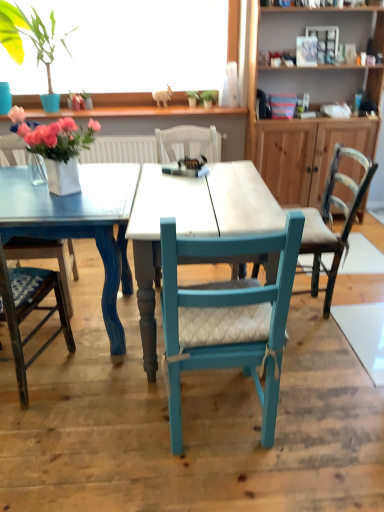
This screenshot has width=384, height=512. What do you see at coordinates (332, 220) in the screenshot?
I see `teal fabric chair at center, placed as the 4th chair when sorted from left to right` at bounding box center [332, 220].

This screenshot has width=384, height=512. What do you see at coordinates (227, 318) in the screenshot?
I see `teal painted wood chair at center, which is the third chair from left to right` at bounding box center [227, 318].

Find the location of `matte blue chair at left, placed as the fourth chair when sorted from right to left`. matte blue chair at left, placed as the fourth chair when sorted from right to left is located at coordinates (46, 257).

Locate an element on the screen. wooden cabinet at upper right is located at coordinates (311, 100).

Identify the location of blue fabric cushioned chair at left, arranged as the 2th chair when viewed from the left. (31, 300).

The width and height of the screenshot is (384, 512). Find the location of `matte pink flowers at left`. matte pink flowers at left is located at coordinates (57, 148).

This screenshot has width=384, height=512. What do you see at coordinates (193, 222) in the screenshot?
I see `white wood table at center` at bounding box center [193, 222].

Find the location of `teal fabric chair at center, the 1th chair positioned from the right`. teal fabric chair at center, the 1th chair positioned from the right is located at coordinates (332, 220).

How distant is teal fabric chair at center, the 1th chair positioned from the right, from white wood table at center?

25.15 inches.

Is teal fabric chair at center, placed as the 4th chair when sorted from left to right, further to the viewer compared to white wood table at center?

Yes, the depth of teal fabric chair at center, placed as the 4th chair when sorted from left to right, is greater than that of white wood table at center.

Between teal fabric chair at center, placed as the 4th chair when sorted from left to right, and white wood table at center, which one has smaller width?

teal fabric chair at center, placed as the 4th chair when sorted from left to right.

In the scene shown: Is teal fabric chair at center, placed as the 4th chair when sorted from left to right, outside of white wood table at center?

Absolutely, teal fabric chair at center, placed as the 4th chair when sorted from left to right, is external to white wood table at center.

Between teal fabric chair at center, the 1th chair positioned from the right, and green leafy plant at upper left, which one appears on the left side from the viewer's perspective?

green leafy plant at upper left is more to the left.

Which of these two, teal fabric chair at center, placed as the 4th chair when sorted from left to right, or green leafy plant at upper left, is smaller?

Smaller between the two is teal fabric chair at center, placed as the 4th chair when sorted from left to right.

Is teal fabric chair at center, the 1th chair positioned from the right, far away from green leafy plant at upper left?

Absolutely, teal fabric chair at center, the 1th chair positioned from the right, is distant from green leafy plant at upper left.

The height and width of the screenshot is (512, 384). What are the coordinates of `houseplant above the teal fabric chair at center, the 1th chair positioned from the right (from the image's perspective)` in the screenshot? It's located at (27, 36).

Find the location of `houseplant that is behind the matte blue chair at left, the 1th chair when ordered from left to right`. houseplant that is behind the matte blue chair at left, the 1th chair when ordered from left to right is located at coordinates (27, 36).

Is matte blue chair at left, placed as the fourth chair when sorted from right to left, at the right side of green leafy plant at upper left?

Indeed, matte blue chair at left, placed as the fourth chair when sorted from right to left, is positioned on the right side of green leafy plant at upper left.

Looking at this image, is matte blue chair at left, placed as the fourth chair when sorted from right to left, positioned beyond the bounds of green leafy plant at upper left?

Yes, matte blue chair at left, placed as the fourth chair when sorted from right to left, is located beyond the bounds of green leafy plant at upper left.

In terms of size, does matte blue chair at left, placed as the fourth chair when sorted from right to left, appear bigger or smaller than teal painted wood chair at center, acting as the 2th chair starting from the right?

Considering their sizes, matte blue chair at left, placed as the fourth chair when sorted from right to left, takes up more space than teal painted wood chair at center, acting as the 2th chair starting from the right.

From the image's perspective, which one is positioned lower, matte blue chair at left, placed as the fourth chair when sorted from right to left, or teal painted wood chair at center, which is the third chair from left to right?

teal painted wood chair at center, which is the third chair from left to right, is shown below in the image.

Considering the positions of objects matte blue chair at left, the 1th chair when ordered from left to right, and teal painted wood chair at center, acting as the 2th chair starting from the right, in the image provided, who is more to the right, matte blue chair at left, the 1th chair when ordered from left to right, or teal painted wood chair at center, acting as the 2th chair starting from the right,?

teal painted wood chair at center, acting as the 2th chair starting from the right, is more to the right.

How far apart are matte blue chair at left, placed as the fourth chair when sorted from right to left, and teal painted wood chair at center, acting as the 2th chair starting from the right?

A distance of 34.30 inches exists between matte blue chair at left, placed as the fourth chair when sorted from right to left, and teal painted wood chair at center, acting as the 2th chair starting from the right.

Is blue fabric cushioned chair at left, marked as the third chair in a right-to-left arrangement, facing towards green leafy plant at upper left?

Yes, blue fabric cushioned chair at left, marked as the third chair in a right-to-left arrangement, is turned towards green leafy plant at upper left.

How far apart are blue fabric cushioned chair at left, arranged as the 2th chair when viewed from the left, and green leafy plant at upper left?

A distance of 5.85 feet exists between blue fabric cushioned chair at left, arranged as the 2th chair when viewed from the left, and green leafy plant at upper left.

Consider the image. What's the angular difference between blue fabric cushioned chair at left, marked as the third chair in a right-to-left arrangement, and green leafy plant at upper left's facing directions?

The facing directions of blue fabric cushioned chair at left, marked as the third chair in a right-to-left arrangement, and green leafy plant at upper left are 170 degrees apart.

Where is `houseplant on the left side of blue fabric cushioned chair at left, marked as the third chair in a right-to-left arrangement`? houseplant on the left side of blue fabric cushioned chair at left, marked as the third chair in a right-to-left arrangement is located at coordinates (27, 36).

Considering the sizes of objects white wood table at center and blue fabric cushioned chair at left, marked as the third chair in a right-to-left arrangement, in the image provided, who is taller, white wood table at center or blue fabric cushioned chair at left, marked as the third chair in a right-to-left arrangement,?

With more height is blue fabric cushioned chair at left, marked as the third chair in a right-to-left arrangement.

In the scene shown: Is white wood table at center looking in the opposite direction of blue fabric cushioned chair at left, arranged as the 2th chair when viewed from the left?

No, white wood table at center's orientation is not away from blue fabric cushioned chair at left, arranged as the 2th chair when viewed from the left.

How different are the orientations of white wood table at center and blue fabric cushioned chair at left, marked as the third chair in a right-to-left arrangement, in degrees?

171 degrees.

Which of these two, white wood table at center or blue fabric cushioned chair at left, arranged as the 2th chair when viewed from the left, is bigger?

Bigger between the two is white wood table at center.

Could you tell me if teal fabric chair at center, the 1th chair positioned from the right, is turned towards blue fabric cushioned chair at left, arranged as the 2th chair when viewed from the left?

No, teal fabric chair at center, the 1th chair positioned from the right, is not aimed at blue fabric cushioned chair at left, arranged as the 2th chair when viewed from the left.

Choose the correct answer: Is teal fabric chair at center, placed as the 4th chair when sorted from left to right, inside blue fabric cushioned chair at left, marked as the third chair in a right-to-left arrangement, or outside it?

teal fabric chair at center, placed as the 4th chair when sorted from left to right, cannot be found inside blue fabric cushioned chair at left, marked as the third chair in a right-to-left arrangement.

How distant is teal fabric chair at center, placed as the 4th chair when sorted from left to right, from blue fabric cushioned chair at left, marked as the third chair in a right-to-left arrangement?

4.31 feet.

Which object is closer to the camera, teal fabric chair at center, the 1th chair positioned from the right, or blue fabric cushioned chair at left, marked as the third chair in a right-to-left arrangement?

blue fabric cushioned chair at left, marked as the third chair in a right-to-left arrangement, is more forward.

Locate an element on the screen. The image size is (384, 512). the 1st chair above when counting from the white wood table at center (from the image's perspective) is located at coordinates (332, 220).

Where is `the 2nd chair below when counting from the green leafy plant at upper left (from the image's perspective)`? the 2nd chair below when counting from the green leafy plant at upper left (from the image's perspective) is located at coordinates (332, 220).

Which object lies further to the anchor point teal painted wood chair at center, which is the third chair from left to right, matte blue chair at left, the 1th chair when ordered from left to right, or white wood table at center?

Among the two, matte blue chair at left, the 1th chair when ordered from left to right, is located further to teal painted wood chair at center, which is the third chair from left to right.

From the image, which object appears to be nearer to teal painted wood chair at center, which is the third chair from left to right, white wood table at center or matte pink flowers at left?

white wood table at center.

Looking at the image, which one is located closer to wooden cabinet at upper right, teal fabric chair at center, the 1th chair positioned from the right, or green leafy plant at upper left?

The object closer to wooden cabinet at upper right is teal fabric chair at center, the 1th chair positioned from the right.

When comparing their distances from teal fabric chair at center, the 1th chair positioned from the right, does matte blue chair at left, the 1th chair when ordered from left to right, or matte pink flowers at left seem closer?

matte pink flowers at left is closer to teal fabric chair at center, the 1th chair positioned from the right.

From the image, which object appears to be nearer to wooden cabinet at upper right, white wood table at center or blue fabric cushioned chair at left, marked as the third chair in a right-to-left arrangement?

white wood table at center is closer to wooden cabinet at upper right.

Looking at the image, which one is located further to teal fabric chair at center, the 1th chair positioned from the right, matte pink flowers at left or matte blue chair at left, placed as the fourth chair when sorted from right to left?

matte blue chair at left, placed as the fourth chair when sorted from right to left, is further to teal fabric chair at center, the 1th chair positioned from the right.

Considering their positions, is blue fabric cushioned chair at left, arranged as the 2th chair when viewed from the left, positioned further to matte pink flowers at left than white wood table at center?

The object further to matte pink flowers at left is blue fabric cushioned chair at left, arranged as the 2th chair when viewed from the left.

Which object lies nearer to the anchor point teal painted wood chair at center, acting as the 2th chair starting from the right, white wood table at center or teal fabric chair at center, the 1th chair positioned from the right?

white wood table at center is positioned closer to the anchor teal painted wood chair at center, acting as the 2th chair starting from the right.

Locate an element on the screen. kitchen & dining room table between matte blue chair at left, placed as the fourth chair when sorted from right to left, and wooden cabinet at upper right, in the horizontal direction is located at coordinates (193, 222).

You are a GUI agent. You are given a task and a screenshot of the screen. Output one action in this format:
    pyautogui.click(x=<x>, y=<y>)
    Task: Click on the floral arrangement between blue fabric cushioned chair at left, arranged as the 2th chair when viewed from the left, and matte blue chair at left, the 1th chair when ordered from left to right, along the z-axis
    The image size is (384, 512).
    Given the screenshot: What is the action you would take?
    pyautogui.click(x=57, y=148)

At what (x,y) coordinates should I click in order to perform the action: click on floral arrangement between green leafy plant at upper left and teal painted wood chair at center, which is the third chair from left to right, vertically. Please return your answer as a coordinate pair (x, y). Looking at the image, I should click on (57, 148).

This screenshot has height=512, width=384. Find the location of `kitchen & dining room table between green leafy plant at upper left and blue fabric cushioned chair at left, marked as the third chair in a right-to-left arrangement, in the vertical direction`. kitchen & dining room table between green leafy plant at upper left and blue fabric cushioned chair at left, marked as the third chair in a right-to-left arrangement, in the vertical direction is located at coordinates [193, 222].